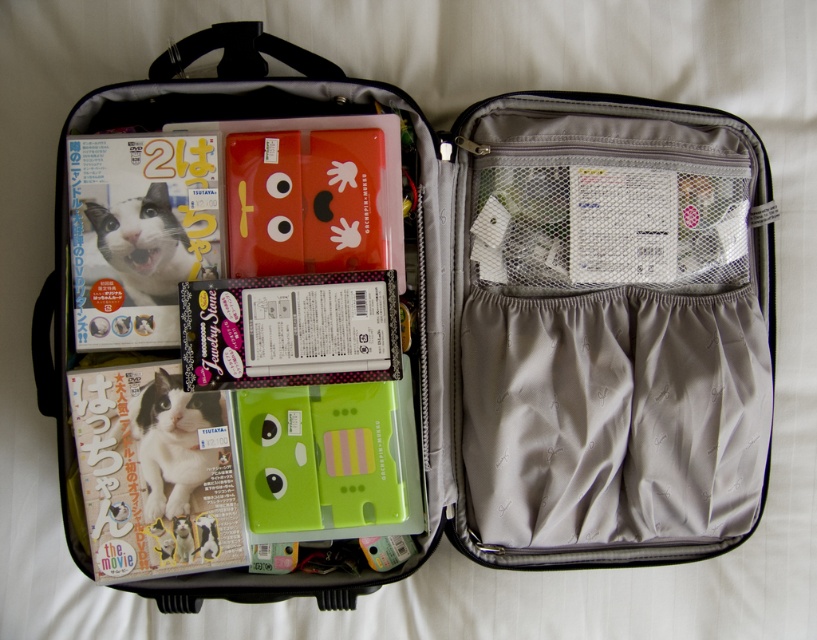
Is matte paper magazine at lower left taller than matte paper magazine at left?

Indeed, matte paper magazine at lower left has a greater height compared to matte paper magazine at left.

Can you confirm if matte paper magazine at lower left is thinner than matte paper magazine at left?

Incorrect, matte paper magazine at lower left's width is not less than matte paper magazine at left's.

From the picture: Who is more distant from viewer, (x=168, y=404) or (x=206, y=220)?

The point (x=206, y=220) is behind.

Where is `matte paper magazine at lower left`? matte paper magazine at lower left is located at coordinates (155, 472).